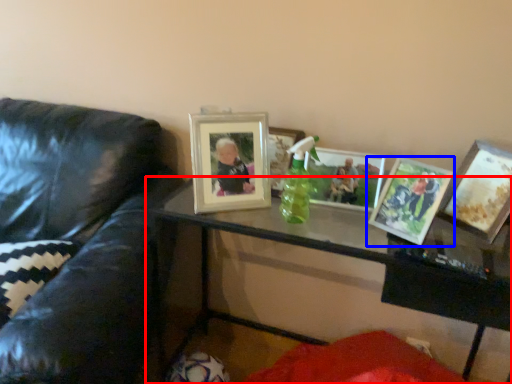
Question: Which object is further to the camera taking this photo, table (highlighted by a red box) or picture frame (highlighted by a blue box)?

Choices:
 (A) table
 (B) picture frame

Answer: (B)